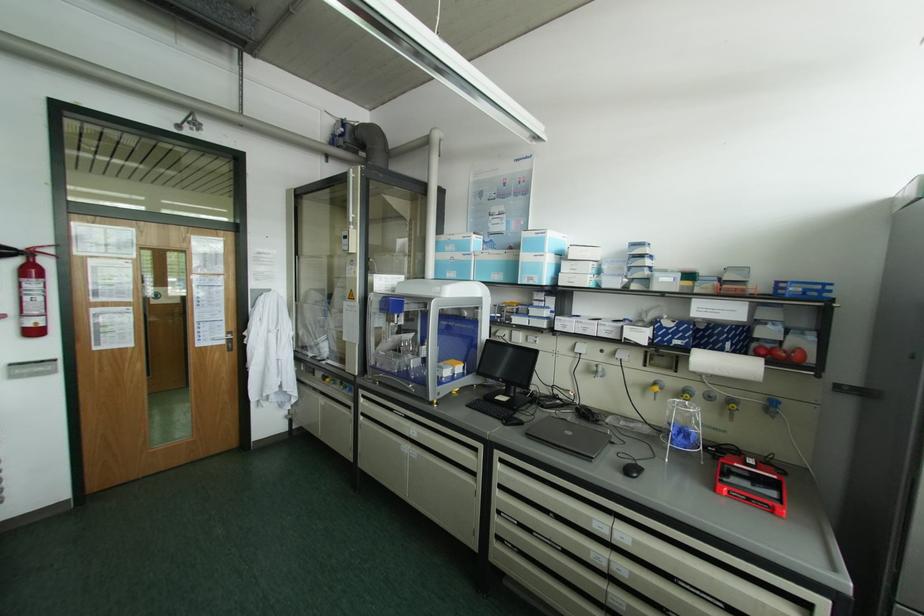
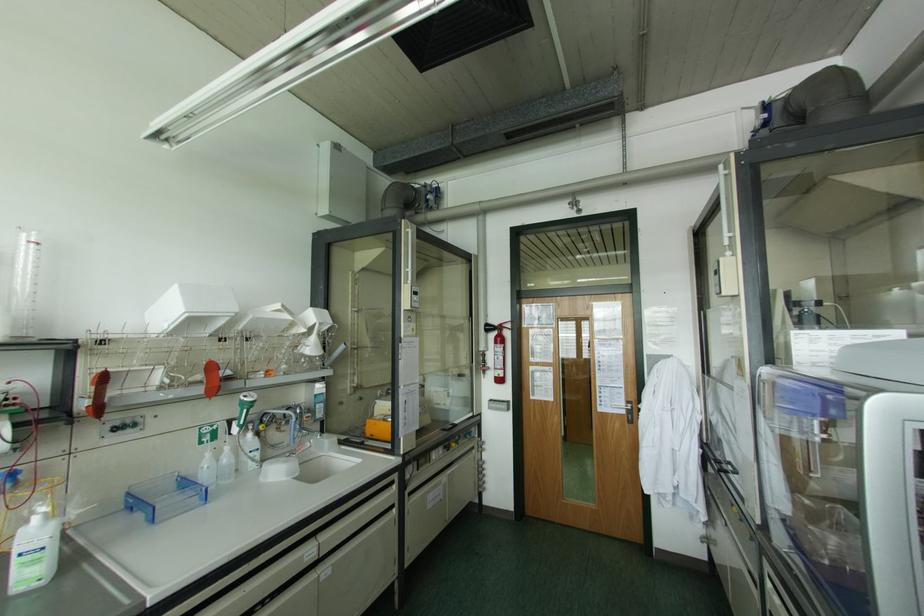
Find the pixel in the second image that matches point (51, 249) in the first image.

(507, 325)